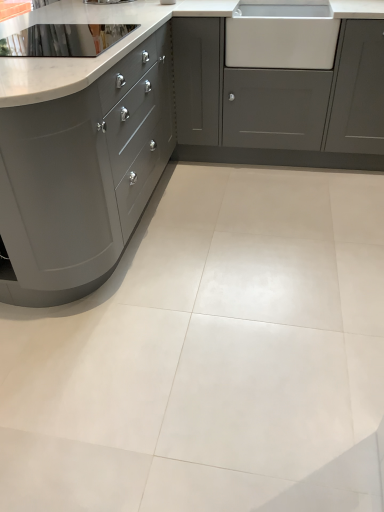
Question: Is matte gray cabinet at center, the first cabinetry positioned from the right, looking in the opposite direction of matte gray cabinetry at left, marked as the first cabinetry in a left-to-right arrangement?

Choices:
 (A) no
 (B) yes

Answer: (A)

Question: Can you confirm if matte gray cabinet at center, marked as the second cabinetry in a left-to-right arrangement, is shorter than matte gray cabinetry at left, marked as the first cabinetry in a left-to-right arrangement?

Choices:
 (A) no
 (B) yes

Answer: (B)

Question: Is matte gray cabinet at center, marked as the second cabinetry in a left-to-right arrangement, in front of matte gray cabinetry at left, which is counted as the 2th cabinetry, starting from the right?

Choices:
 (A) no
 (B) yes

Answer: (A)

Question: From a real-world perspective, does matte gray cabinet at center, marked as the second cabinetry in a left-to-right arrangement, stand above matte gray cabinetry at left, which is counted as the 2th cabinetry, starting from the right?

Choices:
 (A) yes
 (B) no

Answer: (B)

Question: Is the position of matte gray cabinet at center, marked as the second cabinetry in a left-to-right arrangement, more distant than that of matte gray cabinetry at left, which is counted as the 2th cabinetry, starting from the right?

Choices:
 (A) no
 (B) yes

Answer: (B)

Question: Is point (84, 140) closer or farther from the camera than point (331, 29)?

Choices:
 (A) farther
 (B) closer

Answer: (B)

Question: Is matte gray cabinetry at left, which is counted as the 2th cabinetry, starting from the right, wider or thinner than white glossy sink at upper right?

Choices:
 (A) thin
 (B) wide

Answer: (B)

Question: From the image's perspective, is matte gray cabinetry at left, marked as the first cabinetry in a left-to-right arrangement, positioned above or below white glossy sink at upper right?

Choices:
 (A) below
 (B) above

Answer: (A)

Question: In the image, is matte gray cabinetry at left, which is counted as the 2th cabinetry, starting from the right, on the left side or the right side of white glossy sink at upper right?

Choices:
 (A) right
 (B) left

Answer: (B)

Question: Considering the positions of matte gray cabinet at center, the first cabinetry positioned from the right, and matte gray cabinetry at left, marked as the first cabinetry in a left-to-right arrangement, in the image, is matte gray cabinet at center, the first cabinetry positioned from the right, taller or shorter than matte gray cabinetry at left, marked as the first cabinetry in a left-to-right arrangement,?

Choices:
 (A) tall
 (B) short

Answer: (B)

Question: In terms of size, does matte gray cabinet at center, marked as the second cabinetry in a left-to-right arrangement, appear bigger or smaller than matte gray cabinetry at left, which is counted as the 2th cabinetry, starting from the right?

Choices:
 (A) big
 (B) small

Answer: (B)

Question: In terms of width, does matte gray cabinet at center, the first cabinetry positioned from the right, look wider or thinner when compared to matte gray cabinetry at left, which is counted as the 2th cabinetry, starting from the right?

Choices:
 (A) thin
 (B) wide

Answer: (A)

Question: In the image, is matte gray cabinet at center, the first cabinetry positioned from the right, positioned in front of or behind matte gray cabinetry at left, which is counted as the 2th cabinetry, starting from the right?

Choices:
 (A) front
 (B) behind

Answer: (B)

Question: In terms of width, does polished stainless steel sink at upper left look wider or thinner when compared to white glossy tile at center?

Choices:
 (A) thin
 (B) wide

Answer: (A)

Question: From a real-world perspective, relative to white glossy tile at center, is polished stainless steel sink at upper left vertically above or below?

Choices:
 (A) below
 (B) above

Answer: (B)